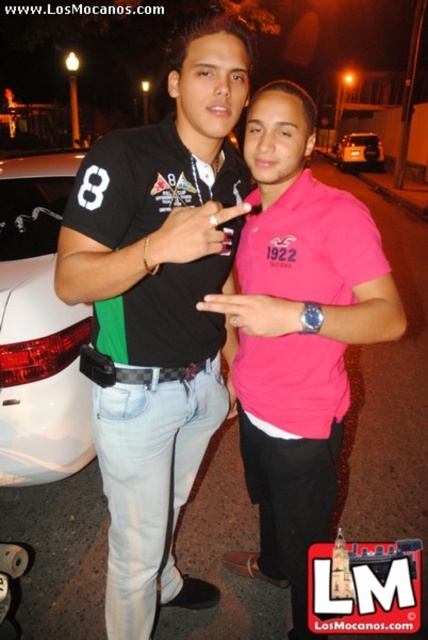
You are a delivery person who needs to park your van between the white glossy car at left and the metallic silver car at center. The van is 20 feet long. Can you fit the van between them?

The distance between the white glossy car at left and the metallic silver car at center is 75.87 feet. Since the van is only 20 feet long, there is sufficient space to park it between them.

You are a photographer adjusting your camera settings to focus on two specific points in the image. The points are labeled as point (x=55, y=227) and point (x=348, y=164). Which of these two points is nearer to the camera?

Point (x=55, y=227) is closer to the camera than point (x=348, y=164).

You are a photographer standing 2 meters away from the camera. You want to take a photo of the white glossy car at left. Can you reach the car to adjust its position?

The white glossy car at left is 2.19 meters away from the camera. Since you are standing 2 meters away from the camera, the total distance between you and the car is 4.19 meters. Therefore, you cannot reach the car to adjust its position.